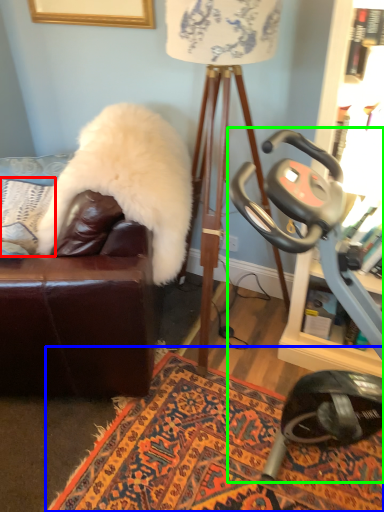
Question: Which object is positioned closest to pillow (highlighted by a red box)? Select from mat (highlighted by a blue box) and stationary bicycle (highlighted by a green box).

Choices:
 (A) mat
 (B) stationary bicycle

Answer: (A)